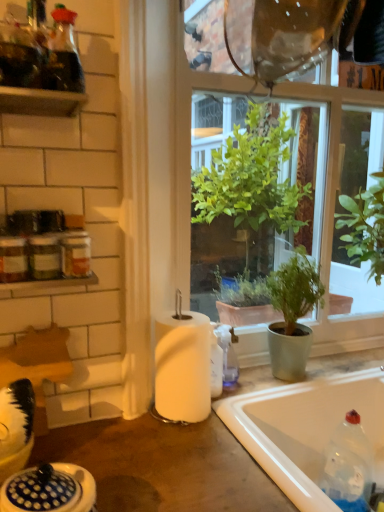
In order to click on vacant area on the back side of white glossy sink at lower left in this screenshot , I will do `click(108, 461)`.